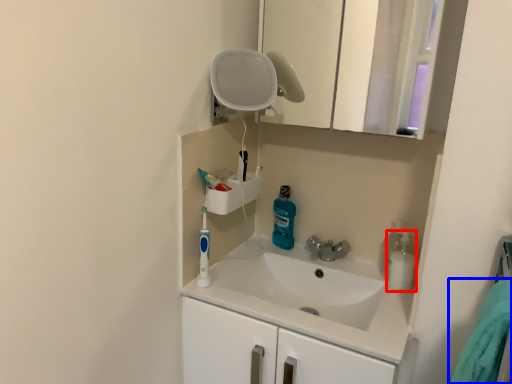
Question: Which object is closer to the camera taking this photo, cleaning product (highlighted by a red box) or bath towel (highlighted by a blue box)?

Choices:
 (A) cleaning product
 (B) bath towel

Answer: (B)